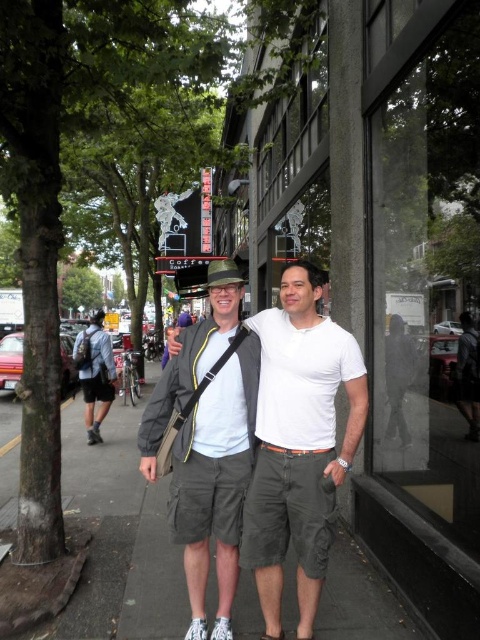
Question: Does gray concrete sidewalk at center come behind matte gray shorts at center?

Choices:
 (A) yes
 (B) no

Answer: (A)

Question: Which of the following is the closest to the observer?

Choices:
 (A) gray concrete sidewalk at center
 (B) denim backpack at left
 (C) matte gray shorts at center

Answer: (C)

Question: In this image, where is gray concrete sidewalk at center located relative to matte gray shorts at center?

Choices:
 (A) right
 (B) left

Answer: (B)

Question: Can you confirm if gray concrete sidewalk at center is positioned to the right of matte gray shorts at center?

Choices:
 (A) no
 (B) yes

Answer: (A)

Question: Which point is closer to the camera?

Choices:
 (A) (111, 369)
 (B) (267, 364)

Answer: (B)

Question: Among these points, which one is farthest from the camera?

Choices:
 (A) (112, 362)
 (B) (124, 480)

Answer: (A)